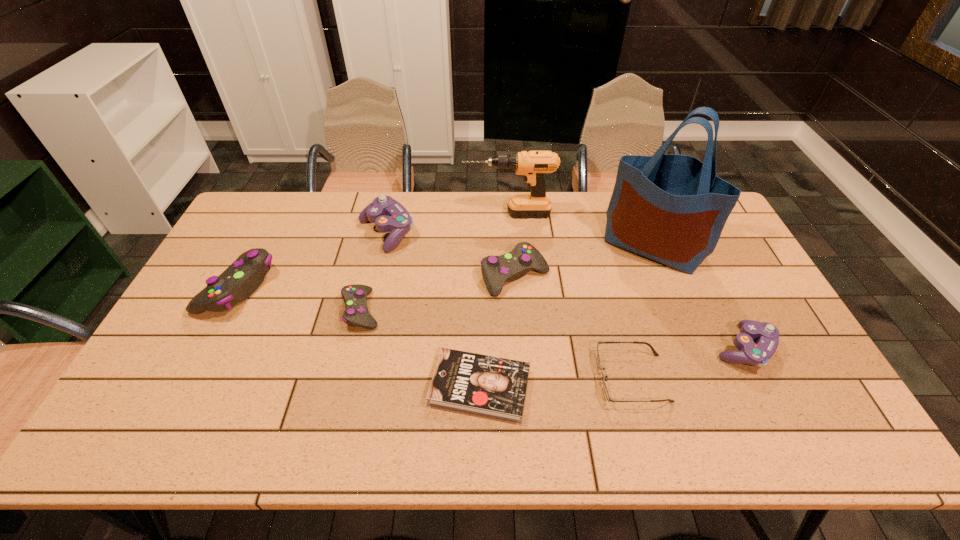
Locate which object is the third closest to the drill. Please provide its 2D coordinates. Your answer should be formatted as a tuple, i.e. [(x, y)], where the tuple contains the x and y coordinates of a point satisfying the conditions above.

[(496, 270)]

The height and width of the screenshot is (540, 960). What are the coordinates of `the sixth closest object to the book` in the screenshot? It's located at (756, 354).

Find the location of `control that stands as the fourth closest to the leftmost object`. control that stands as the fourth closest to the leftmost object is located at coordinates (756, 354).

Locate which control is the third closest to the leftmost object. Please provide its 2D coordinates. Your answer should be formatted as a tuple, i.e. [(x, y)], where the tuple contains the x and y coordinates of a point satisfying the conditions above.

[(496, 270)]

Find the location of a particular element. Image resolution: width=960 pixels, height=540 pixels. the closest gray control to the third shortest object is located at coordinates (241, 279).

This screenshot has height=540, width=960. Identify the location of gray control that stands as the third closest to the shortest object. 241,279.

The height and width of the screenshot is (540, 960). What are the coordinates of `free spot that satisfies the following two spatial constraints: 1. on the back side of the smaller purple control; 2. on the left side of the book` in the screenshot? It's located at (480, 348).

Where is `free space that satisfies the following two spatial constraints: 1. on the front side of the bigger purple control; 2. on the left side of the right purple control`? Image resolution: width=960 pixels, height=540 pixels. free space that satisfies the following two spatial constraints: 1. on the front side of the bigger purple control; 2. on the left side of the right purple control is located at coordinates (360, 348).

You are a GUI agent. You are given a task and a screenshot of the screen. Output one action in this format:
    pyautogui.click(x=<x>, y=<y>)
    Task: Click on the vacant region that satisfies the following two spatial constraints: 1. at the tip of the second control from right to left; 2. on the left side of the eighth shortest object
    
    Given the screenshot: What is the action you would take?
    click(x=513, y=276)

Where is `free space that satisfies the following two spatial constraints: 1. at the tip of the drill; 2. on the front side of the smallest gray control`? free space that satisfies the following two spatial constraints: 1. at the tip of the drill; 2. on the front side of the smallest gray control is located at coordinates (515, 310).